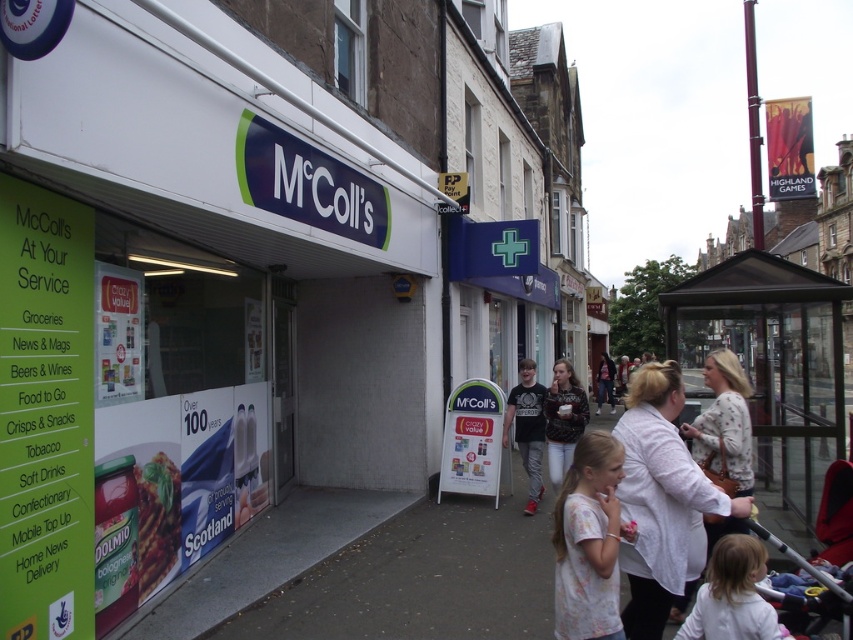
Question: Among these objects, which one is farthest from the camera?

Choices:
 (A) light pink cotton shirt at lower center
 (B) metallic silver baby carriage at lower right
 (C) matte plastic baguette at lower left
 (D) floral-patterned blouse at center

Answer: (C)

Question: Can you confirm if light pink cotton shirt at lower center is bigger than floral-patterned blouse at center?

Choices:
 (A) yes
 (B) no

Answer: (B)

Question: Where is light pink cotton shirt at lower center located in relation to matte plastic baguette at lower left in the image?

Choices:
 (A) right
 (B) left

Answer: (A)

Question: Which of the following is the farthest from the observer?

Choices:
 (A) (630, 637)
 (B) (730, 436)

Answer: (B)

Question: Among these objects, which one is farthest from the camera?

Choices:
 (A) fluffy sweater at center
 (B) green paper sign at left

Answer: (A)

Question: Can you confirm if green paper sign at left is positioned below metallic silver baby carriage at lower right?

Choices:
 (A) no
 (B) yes

Answer: (A)